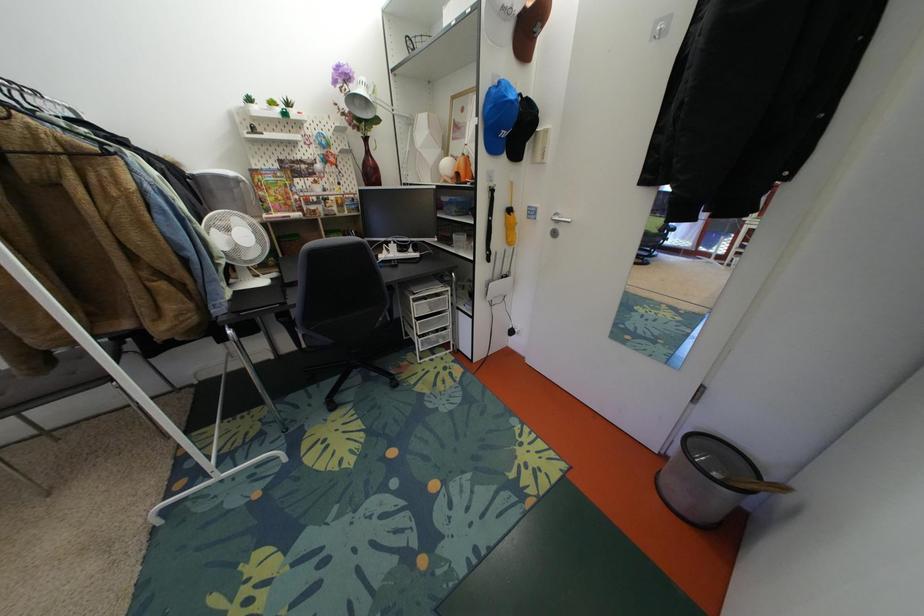
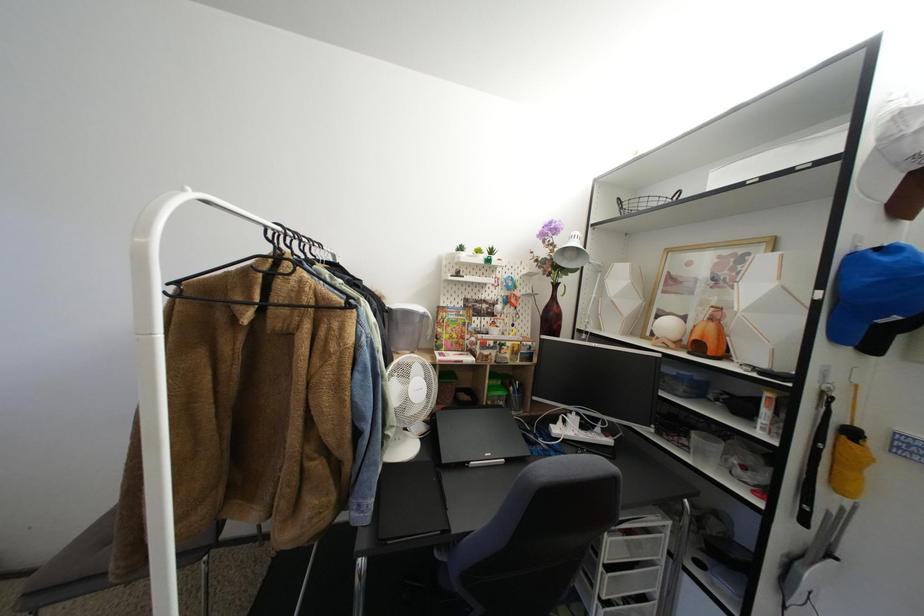
The first image is from the beginning of the video and the second image is from the end. How did the camera likely rotate when shooting the video?

The rotation direction of the camera is left-up.